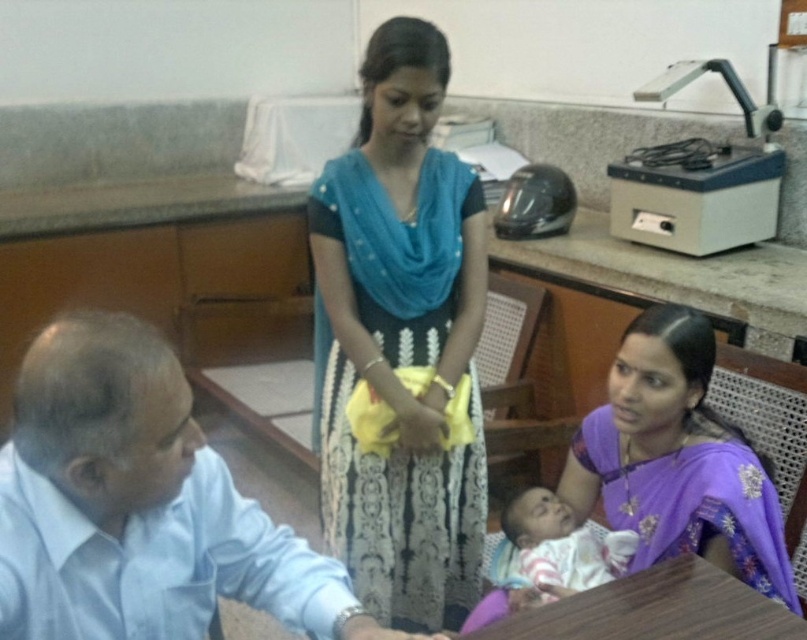
Does light blue shirt at left appear on the right side of purple silk saree at lower right?

In fact, light blue shirt at left is to the left of purple silk saree at lower right.

Who is positioned more to the right, light blue shirt at left or purple silk saree at lower right?

Positioned to the right is purple silk saree at lower right.

Where is `light blue shirt at left`? light blue shirt at left is located at coordinates (138, 504).

Who is lower down, purple silk saree at lower right or soft pink fabric baby at lower center?

soft pink fabric baby at lower center is below.

Does point (680, 387) come behind point (548, 490)?

No, it is not.

The width and height of the screenshot is (807, 640). Describe the element at coordinates (676, 460) in the screenshot. I see `purple silk saree at lower right` at that location.

Where is `purple silk saree at lower right`? purple silk saree at lower right is located at coordinates (676, 460).

Does light blue shirt at left have a lesser height compared to wooden table at lower center?

In fact, light blue shirt at left may be taller than wooden table at lower center.

Is point (56, 332) closer to camera compared to point (490, 632)?

Yes.

Measure the distance between light blue shirt at left and camera.

They are 33.56 inches apart.

You are a GUI agent. You are given a task and a screenshot of the screen. Output one action in this format:
    pyautogui.click(x=<x>, y=<y>)
    Task: Click on the light blue shirt at left
    This screenshot has width=807, height=640.
    Given the screenshot: What is the action you would take?
    pyautogui.click(x=138, y=504)